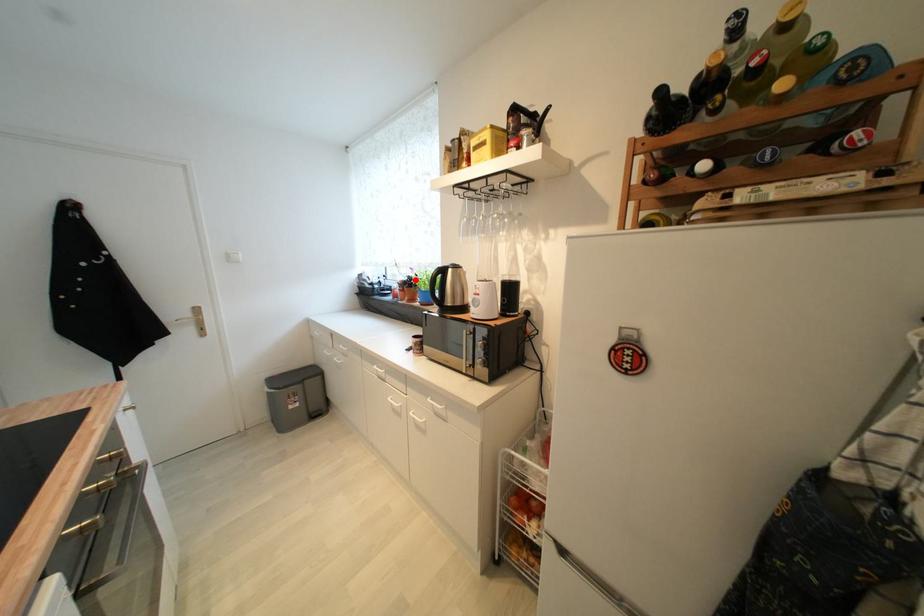
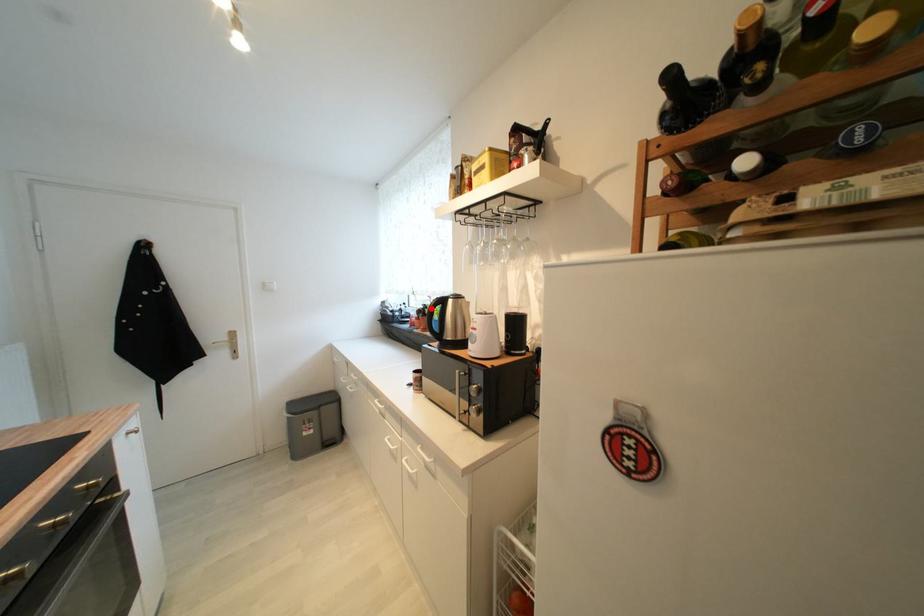
I am providing you with two images of the same scene from different viewpoints. A red point is marked on the first image and another point is marked on the second image. Is the marked point in image1 the same physical position as the marked point in image2?

Yes